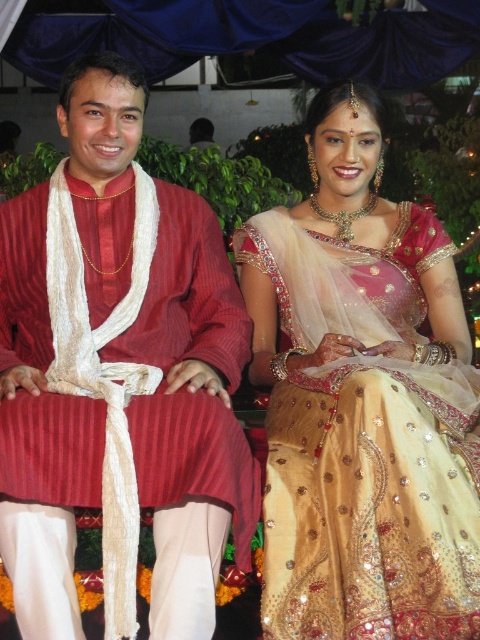
Is matte red fabric at center above golden silk saree at center?

Indeed, matte red fabric at center is positioned over golden silk saree at center.

Which is behind, point (81, 632) or point (333, 100)?

The point (333, 100) is more distant.

The width and height of the screenshot is (480, 640). What do you see at coordinates (118, 376) in the screenshot?
I see `matte red fabric at center` at bounding box center [118, 376].

This screenshot has width=480, height=640. I want to click on matte red fabric at center, so click(118, 376).